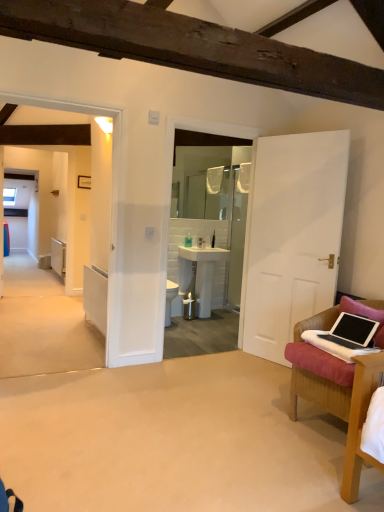
Question: Is translucent plastic bottle at center oriented towards pink fabric pillow at right?

Choices:
 (A) no
 (B) yes

Answer: (B)

Question: Can you confirm if translucent plastic bottle at center is positioned to the right of pink fabric pillow at right?

Choices:
 (A) no
 (B) yes

Answer: (A)

Question: Is the position of translucent plastic bottle at center less distant than that of pink fabric pillow at right?

Choices:
 (A) no
 (B) yes

Answer: (A)

Question: Is translucent plastic bottle at center positioned far away from pink fabric pillow at right?

Choices:
 (A) yes
 (B) no

Answer: (A)

Question: Considering the relative sizes of translucent plastic bottle at center and pink fabric pillow at right in the image provided, is translucent plastic bottle at center shorter than pink fabric pillow at right?

Choices:
 (A) no
 (B) yes

Answer: (B)

Question: In the image, is pink fabric pillow at right positioned in front of or behind black matte laptop at lower right?

Choices:
 (A) front
 (B) behind

Answer: (B)

Question: Considering the positions of pink fabric pillow at right and black matte laptop at lower right in the image, is pink fabric pillow at right taller or shorter than black matte laptop at lower right?

Choices:
 (A) short
 (B) tall

Answer: (B)

Question: From a real-world perspective, is pink fabric pillow at right positioned above or below black matte laptop at lower right?

Choices:
 (A) below
 (B) above

Answer: (B)

Question: From the image's perspective, is pink fabric pillow at right above or below black matte laptop at lower right?

Choices:
 (A) above
 (B) below

Answer: (A)

Question: In terms of height, does white frosted glass mirror at center look taller or shorter compared to black matte laptop at lower right?

Choices:
 (A) short
 (B) tall

Answer: (B)

Question: Would you say white frosted glass mirror at center is inside or outside black matte laptop at lower right?

Choices:
 (A) outside
 (B) inside

Answer: (A)

Question: In terms of width, does white frosted glass mirror at center look wider or thinner when compared to black matte laptop at lower right?

Choices:
 (A) thin
 (B) wide

Answer: (A)

Question: From the image's perspective, relative to black matte laptop at lower right, is white frosted glass mirror at center above or below?

Choices:
 (A) below
 (B) above

Answer: (B)

Question: From a real-world perspective, is metallic silver trash can at center positioned above or below white glossy sink at center?

Choices:
 (A) below
 (B) above

Answer: (A)

Question: Is metallic silver trash can at center bigger or smaller than white glossy sink at center?

Choices:
 (A) small
 (B) big

Answer: (A)